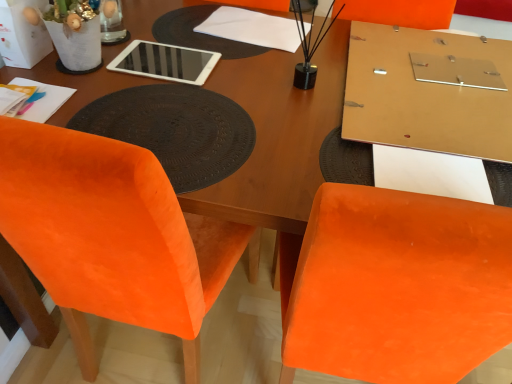
The height and width of the screenshot is (384, 512). I want to click on free location to the right of white glossy tablet at upper center, so [244, 72].